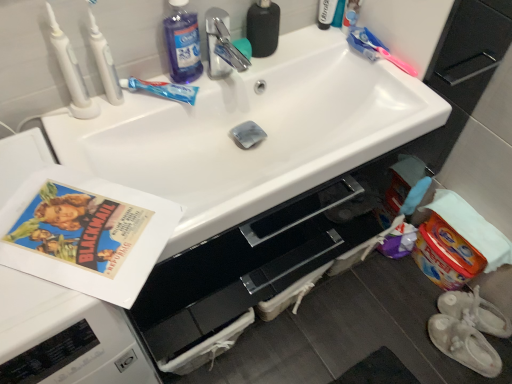
Where is `vacant area in front of translucent blue toothpaste at upper center, placed as the second toothbrush when sorted from right to left`? The image size is (512, 384). vacant area in front of translucent blue toothpaste at upper center, placed as the second toothbrush when sorted from right to left is located at coordinates (121, 130).